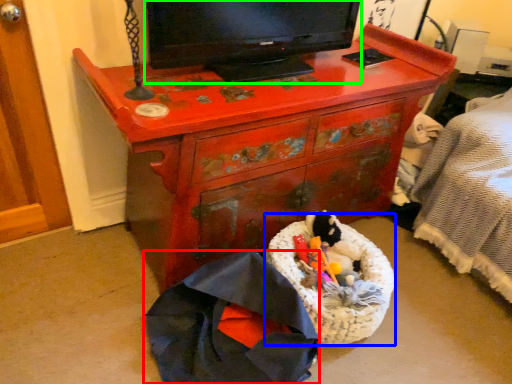
Question: Which object is positioned closest to clothing (highlighted by a red box)? Select from laundry basket (highlighted by a blue box) and television (highlighted by a green box).

Choices:
 (A) laundry basket
 (B) television

Answer: (A)